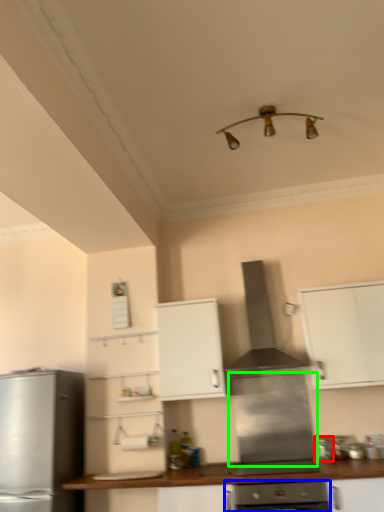
Question: Which object is positioned closest to appliance (highlighted by a red box)? Select from oven (highlighted by a blue box) and appliance (highlighted by a green box).

Choices:
 (A) oven
 (B) appliance

Answer: (B)